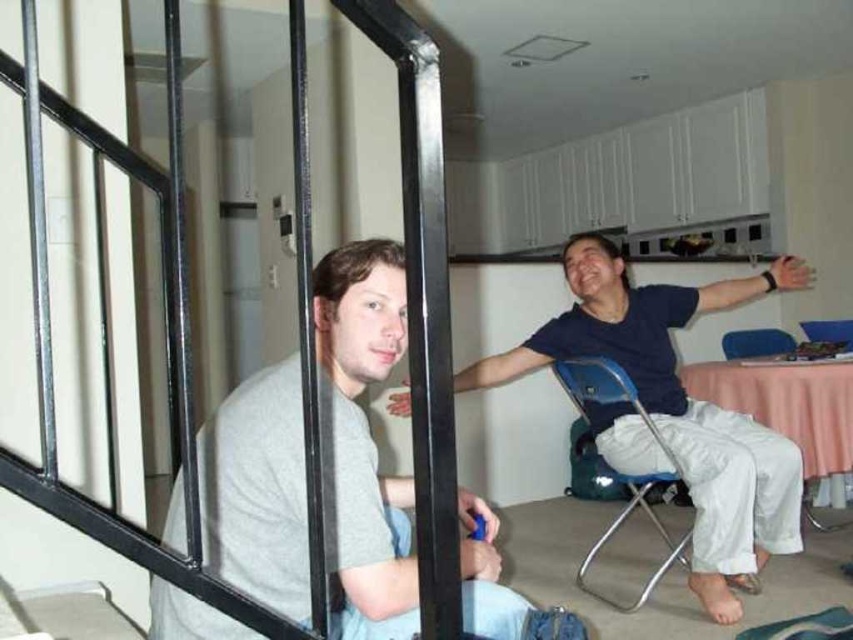
Which is behind, point (732, 536) or point (593, 365)?

The point (593, 365) is more distant.

Between blue cotton shirt at center and blue plastic chair at center, which one is positioned lower?

Positioned lower is blue plastic chair at center.

Does point (717, 496) come in front of point (572, 378)?

Yes.

Find the location of a particular element. blue cotton shirt at center is located at coordinates pos(677,406).

Which is behind, point (672, 550) or point (786, 336)?

Positioned behind is point (786, 336).

From the picture: Between blue plastic chair at center and blue plastic chair at right, which one has more height?

Standing taller between the two is blue plastic chair at center.

What do you see at coordinates (614, 468) in the screenshot?
I see `blue plastic chair at center` at bounding box center [614, 468].

Where is `blue plastic chair at center`? blue plastic chair at center is located at coordinates (614, 468).

Does point (379, 305) come closer to viewer compared to point (843, 486)?

Yes, point (379, 305) is closer to viewer.

Who is shorter, gray matte shirt at left or blue plastic chair at right?

With less height is blue plastic chair at right.

Identify the location of gray matte shirt at left. (364, 433).

Find the location of a particular element. This screenshot has height=640, width=853. gray matte shirt at left is located at coordinates (364, 433).